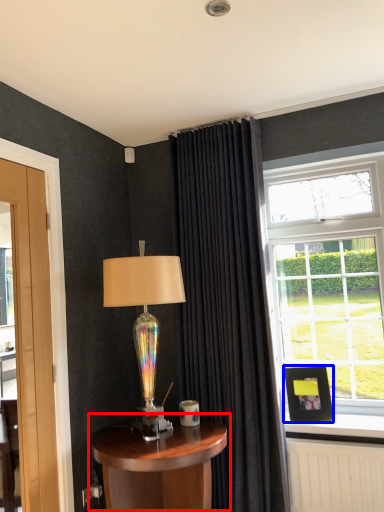
Question: Which point is closer to the camera, table (highlighted by a red box) or picture frame (highlighted by a blue box)?

Choices:
 (A) table
 (B) picture frame

Answer: (A)